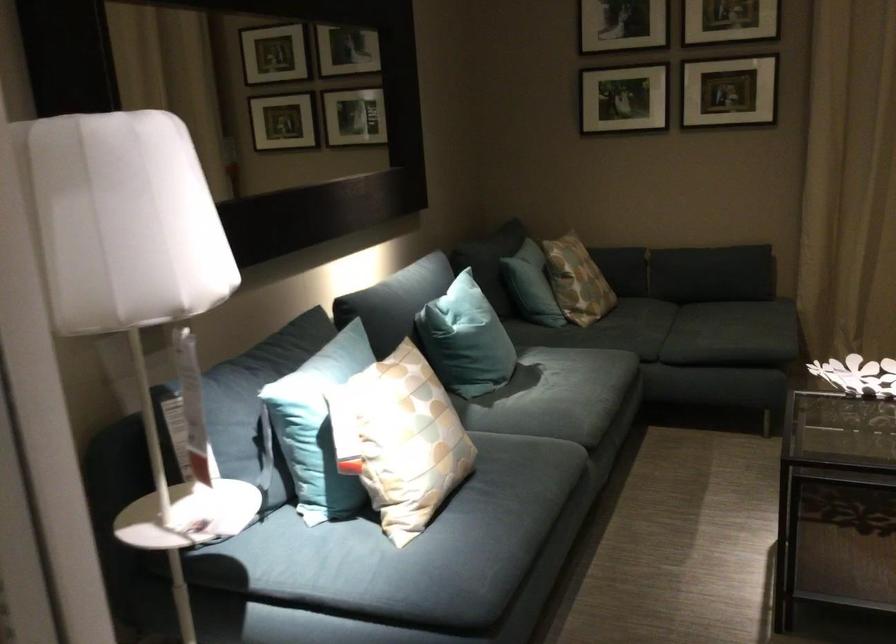
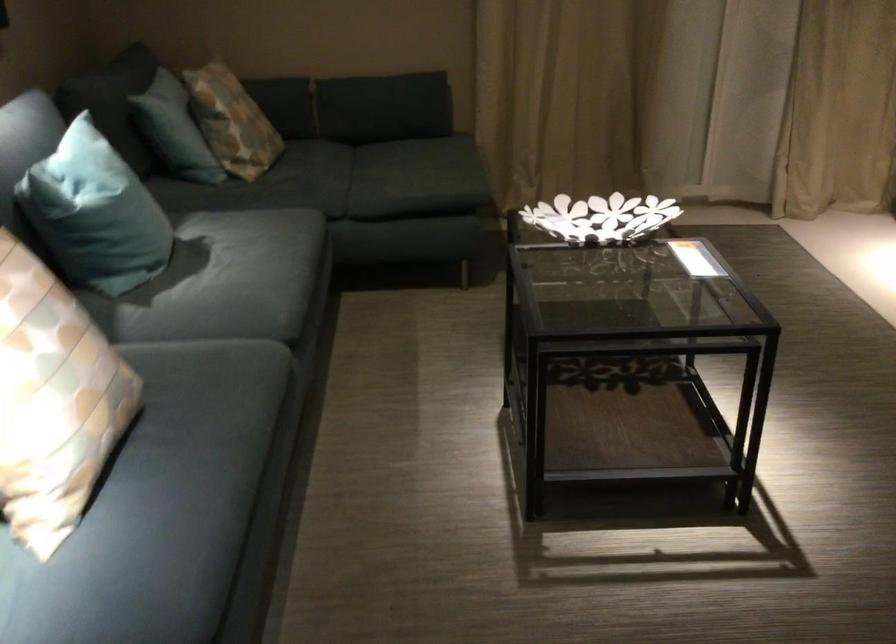
Where in the second image is the point corresponding to (x=407, y=451) from the first image?

(53, 401)